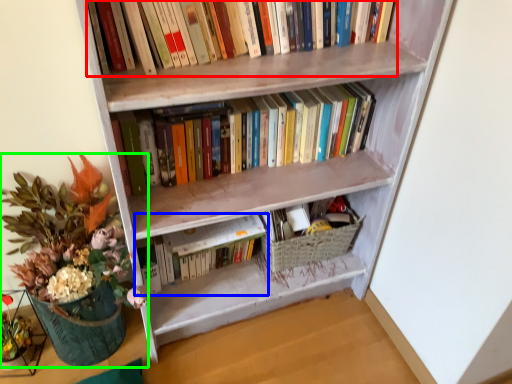
Question: Based on their relative distances, which object is nearer to book (highlighted by a red box)? Choose from book (highlighted by a blue box) and houseplant (highlighted by a green box).

Choices:
 (A) book
 (B) houseplant

Answer: (A)